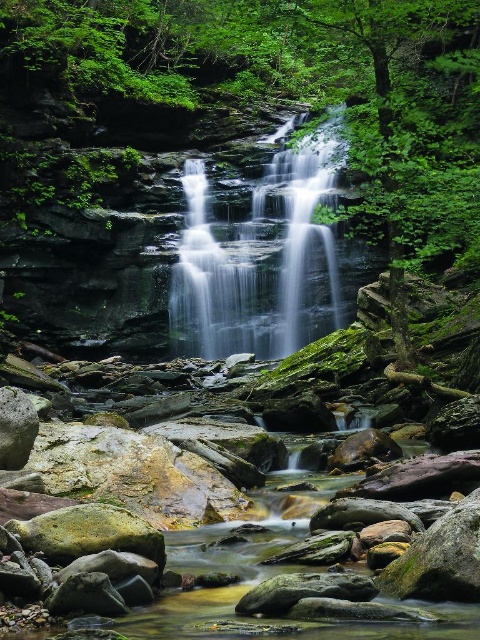
You are standing at the edge of the waterfall in this serene forest scene. You notice a point marked at coordinates (253, 99). Based on the scene description, what natural feature does this point most likely represent?

The point at coordinates (253, 99) corresponds to green mossy rocks at center.

Looking at this image, you are standing at the edge of the waterfall and want to place a small statue on the nearest object in the scene. Which object should you choose between the green mossy rocks at center and the smooth gray water at center?

The green mossy rocks at center are closer to the viewer than the smooth gray water at center, so you should place the statue on the green mossy rocks at center.